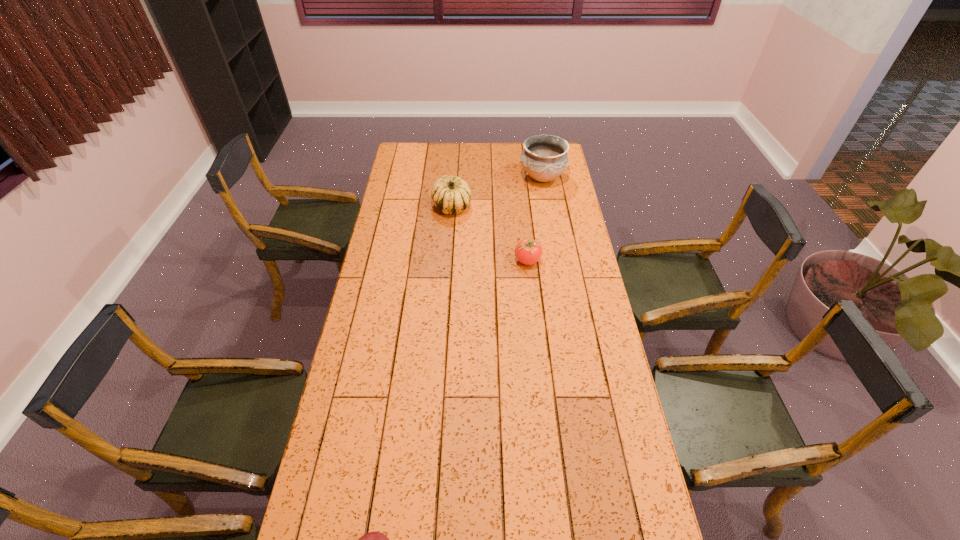
Identify the location of object at the right edge. The image size is (960, 540). 544,158.

What are the coordinates of `object that is at the far right corner` in the screenshot? It's located at (544, 158).

Where is `free space at the far edge of the desktop`? The width and height of the screenshot is (960, 540). free space at the far edge of the desktop is located at coordinates [x=516, y=163].

In the image, there is a desktop. Identify the location of vacant space at the left edge. The image size is (960, 540). (392, 202).

Where is `vacant space at the right edge`? vacant space at the right edge is located at coordinates tap(556, 234).

In the image, there is a desktop. Identify the location of vacant area at the far left corner. The image size is (960, 540). (403, 160).

Find the location of a particular element. This screenshot has width=960, height=540. vacant area that lies between the pottery and the gourd is located at coordinates tap(497, 192).

Find the location of `vacant space in between the farthest object and the third farthest object`. vacant space in between the farthest object and the third farthest object is located at coordinates (535, 219).

Identify the location of vacant space that is in between the pottery and the second tallest object. (x=497, y=192).

I want to click on free point between the farthest object and the gourd, so click(x=497, y=192).